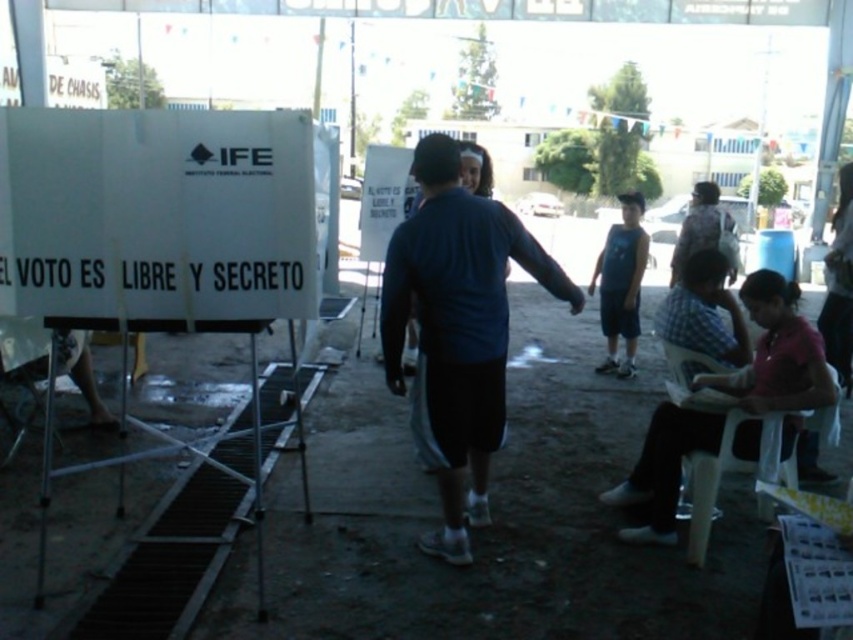
Is dark blue fabric shirt at center in front of pink fabric shirt at lower right?

Yes, dark blue fabric shirt at center is closer to the viewer.

Can you confirm if dark blue fabric shirt at center is positioned to the right of pink fabric shirt at lower right?

No, dark blue fabric shirt at center is not to the right of pink fabric shirt at lower right.

Find the location of a particular element. dark blue fabric shirt at center is located at coordinates (456, 330).

Locate an element on the screen. This screenshot has height=640, width=853. dark blue fabric shirt at center is located at coordinates (456, 330).

Measure the distance between pink fabric shirt at lower right and camera.

pink fabric shirt at lower right and camera are 3.07 meters apart from each other.

Does pink fabric shirt at lower right appear on the left side of blue cotton shirt at center?

Indeed, pink fabric shirt at lower right is positioned on the left side of blue cotton shirt at center.

Where is `pink fabric shirt at lower right`? Image resolution: width=853 pixels, height=640 pixels. pink fabric shirt at lower right is located at coordinates (776, 353).

In the scene shown: Does dark blue fabric shirt at center have a smaller size compared to blue cotton shirt at center?

Incorrect, dark blue fabric shirt at center is not smaller in size than blue cotton shirt at center.

Does point (468, 268) lie in front of point (616, 285)?

That is True.

Where is `dark blue fabric shirt at center`? Image resolution: width=853 pixels, height=640 pixels. dark blue fabric shirt at center is located at coordinates (456, 330).

Identify the location of dark blue fabric shirt at center. Image resolution: width=853 pixels, height=640 pixels. (456, 330).